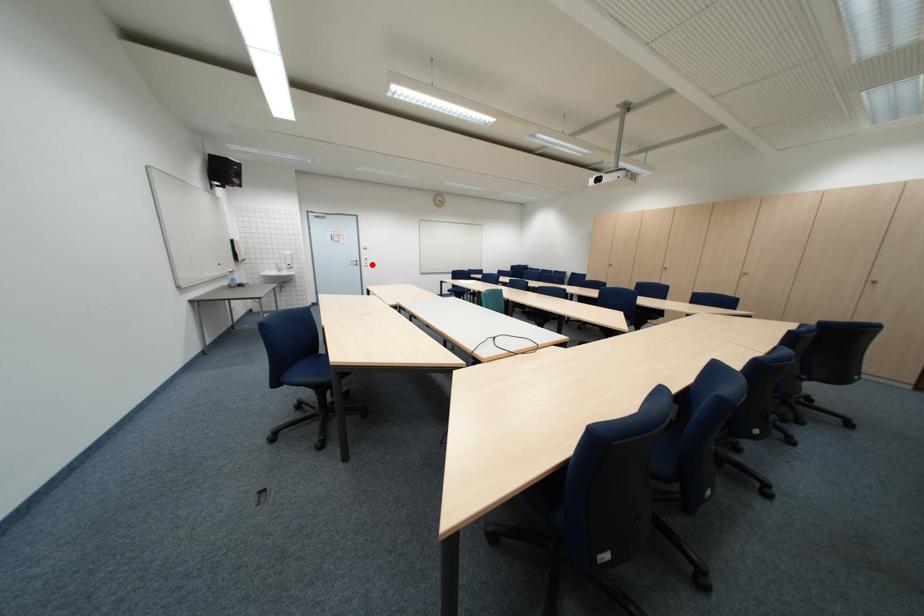
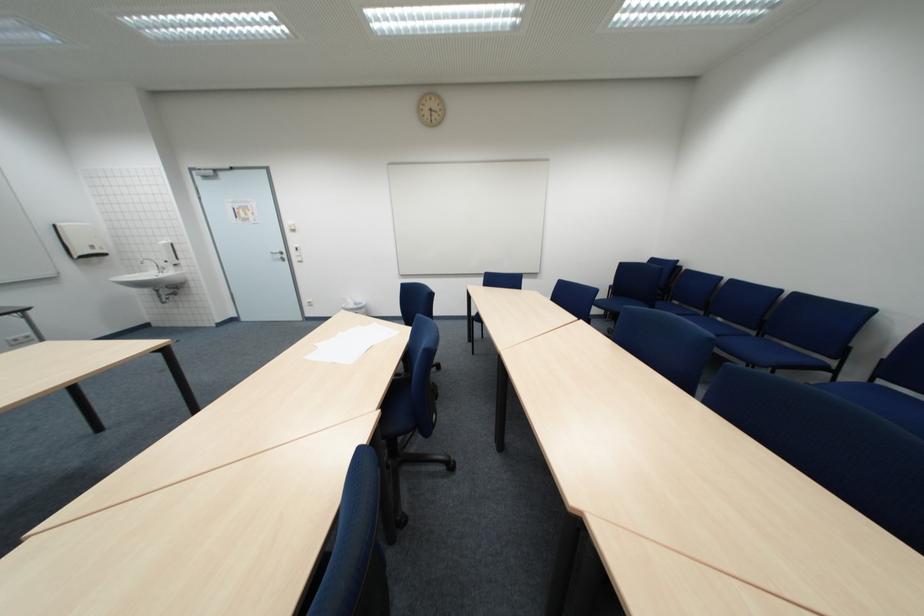
Question: I am providing you with two images of the same scene from different viewpoints. Image1 has a red point marked. In image2, the corresponding 3D location appears at what relative position? Reply with the corresponding letter.

Choices:
 (A) Closer
 (B) Farther

Answer: (B)